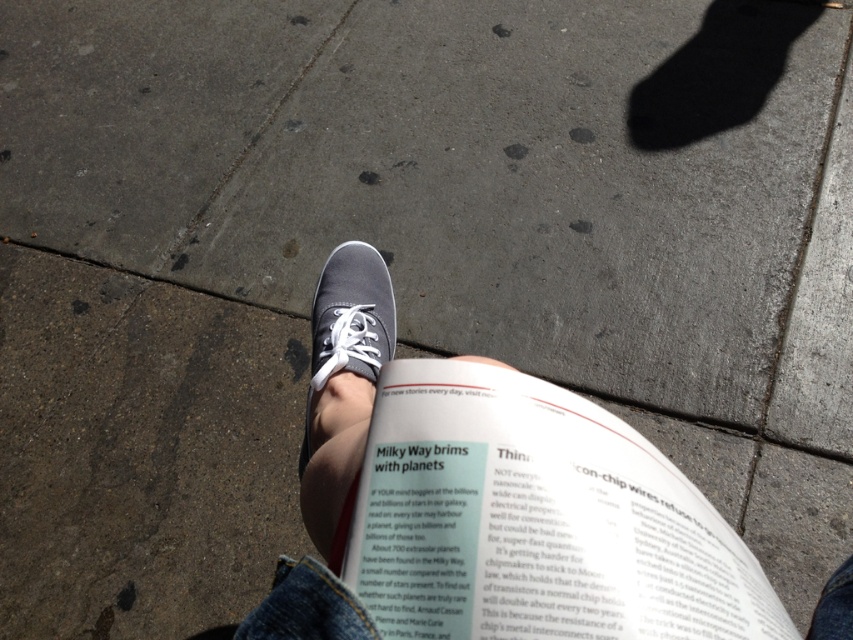
Does white paper at center come behind matte gray sneaker at center?

No, white paper at center is closer to the viewer.

Is white paper at center closer to camera compared to matte gray sneaker at center?

Yes, white paper at center is in front of matte gray sneaker at center.

Which is behind, point (538, 452) or point (344, 355)?

The point (344, 355) is more distant.

Identify the location of white paper at center. (537, 520).